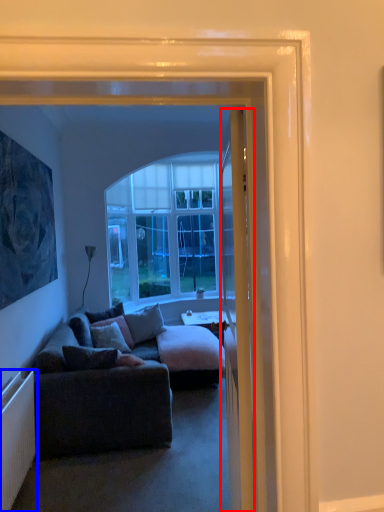
Question: Which object appears closest to the camera in this image, door (highlighted by a red box) or radiator (highlighted by a blue box)?

Choices:
 (A) door
 (B) radiator

Answer: (A)